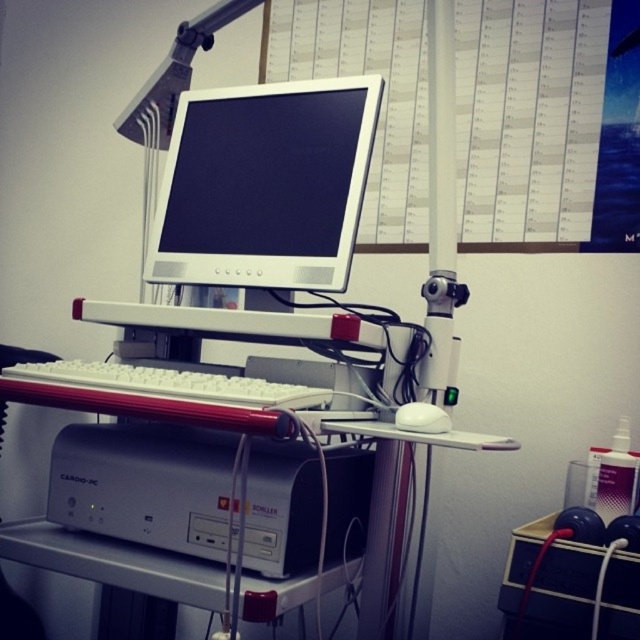
Is point (168, 396) farther from viewer compared to point (400, 408)?

No.

Is white plastic keyboard at center taller than white matte mouse at center?

Yes, white plastic keyboard at center is taller than white matte mouse at center.

Find the location of a particular element. white plastic keyboard at center is located at coordinates (172, 384).

Does point (253, 205) come closer to viewer compared to point (365, 556)?

No, it is not.

In the scene shown: Measure the distance between white glossy monitor at center and white plastic computer desk at center.

A distance of 9.81 inches exists between white glossy monitor at center and white plastic computer desk at center.

At what (x,y) coordinates should I click in order to perform the action: click on white glossy monitor at center. Please return your answer as a coordinate pair (x, y). Looking at the image, I should click on (266, 184).

I want to click on silver metallic printer at lower center, so click(145, 484).

Describe the element at coordinates (145, 484) in the screenshot. I see `silver metallic printer at lower center` at that location.

Between point (312, 468) and point (440, 429), which one is positioned behind?

The point (312, 468) is behind.

The image size is (640, 640). Find the location of `silver metallic printer at lower center`. silver metallic printer at lower center is located at coordinates (145, 484).